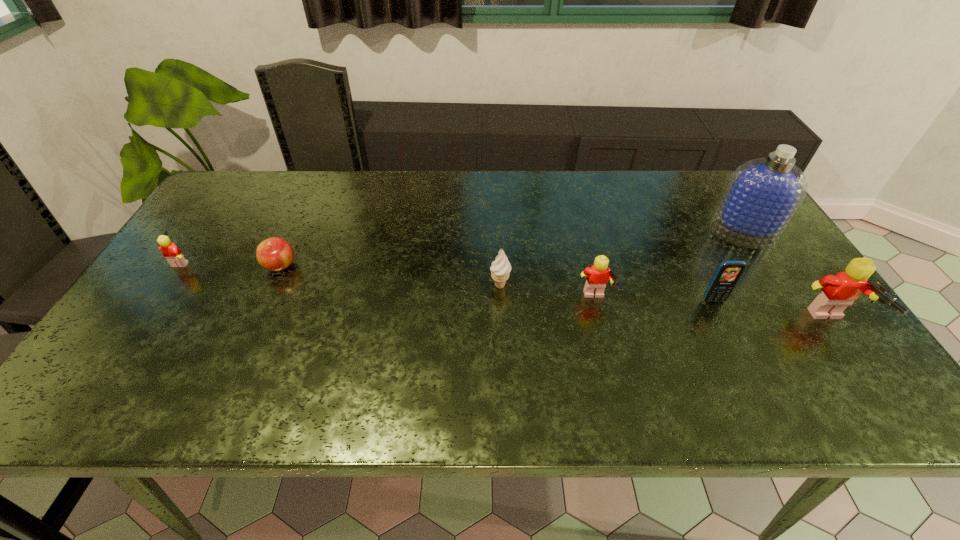
The width and height of the screenshot is (960, 540). What are the coordinates of `the leftmost Lego` in the screenshot? It's located at (170, 251).

Image resolution: width=960 pixels, height=540 pixels. What are the coordinates of `the farthest Lego` in the screenshot? It's located at (170, 251).

Locate an element on the screen. Image resolution: width=960 pixels, height=540 pixels. the fourth object from left to right is located at coordinates (597, 276).

Locate an element on the screen. The image size is (960, 540). the second tallest Lego is located at coordinates (597, 276).

At what (x,y) coordinates should I click in order to perform the action: click on the sixth shortest object. Please return your answer as a coordinate pair (x, y). The height and width of the screenshot is (540, 960). Looking at the image, I should click on (839, 291).

You are a GUI agent. You are given a task and a screenshot of the screen. Output one action in this format:
    pyautogui.click(x=<x>, y=<y>)
    Task: Click on the tallest Lego
    The height and width of the screenshot is (540, 960).
    Given the screenshot: What is the action you would take?
    pyautogui.click(x=839, y=291)

Image resolution: width=960 pixels, height=540 pixels. What are the coordinates of `cleansing agent` in the screenshot? It's located at (763, 194).

This screenshot has height=540, width=960. I want to click on the shortest object, so click(275, 254).

At what (x,y) coordinates should I click in order to perform the action: click on apple. Please return your answer as a coordinate pair (x, y). Image resolution: width=960 pixels, height=540 pixels. Looking at the image, I should click on (275, 254).

You are a GUI agent. You are given a task and a screenshot of the screen. Output one action in this format:
    pyautogui.click(x=<x>, y=<y>)
    Task: Click on the third object from left to right
    This screenshot has height=540, width=960.
    Given the screenshot: What is the action you would take?
    pyautogui.click(x=500, y=269)